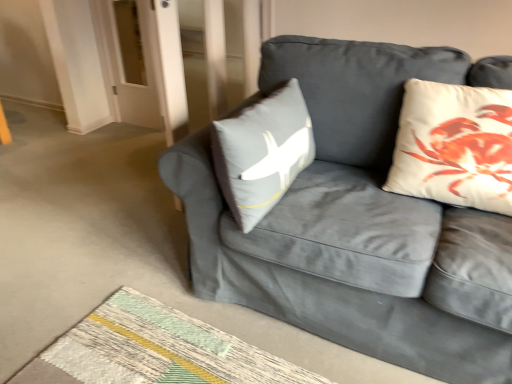
Question: Is textured woven mat at lower center oriented towards white cotton cushion at upper right?

Choices:
 (A) yes
 (B) no

Answer: (B)

Question: From a real-world perspective, is textured woven mat at lower center on white cotton cushion at upper right?

Choices:
 (A) yes
 (B) no

Answer: (B)

Question: Is textured woven mat at lower center bigger than white cotton cushion at upper right?

Choices:
 (A) yes
 (B) no

Answer: (B)

Question: Is textured woven mat at lower center at the left side of white cotton cushion at upper right?

Choices:
 (A) yes
 (B) no

Answer: (A)

Question: From the image's perspective, is textured woven mat at lower center over white cotton cushion at upper right?

Choices:
 (A) yes
 (B) no

Answer: (B)

Question: Does textured woven mat at lower center appear on the right side of white cotton cushion at upper right?

Choices:
 (A) no
 (B) yes

Answer: (A)

Question: Does textured woven mat at lower center have a lesser height compared to velvet gray couch at center?

Choices:
 (A) yes
 (B) no

Answer: (A)

Question: Does textured woven mat at lower center have a lesser width compared to velvet gray couch at center?

Choices:
 (A) no
 (B) yes

Answer: (B)

Question: Is textured woven mat at lower center bigger than velvet gray couch at center?

Choices:
 (A) no
 (B) yes

Answer: (A)

Question: Does textured woven mat at lower center contain velvet gray couch at center?

Choices:
 (A) no
 (B) yes

Answer: (A)

Question: Is the position of textured woven mat at lower center more distant than that of velvet gray couch at center?

Choices:
 (A) yes
 (B) no

Answer: (A)

Question: Is textured woven mat at lower center looking in the opposite direction of velvet gray couch at center?

Choices:
 (A) yes
 (B) no

Answer: (B)

Question: Is textured woven mat at lower center surrounded by velvet gray couch at center?

Choices:
 (A) yes
 (B) no

Answer: (B)